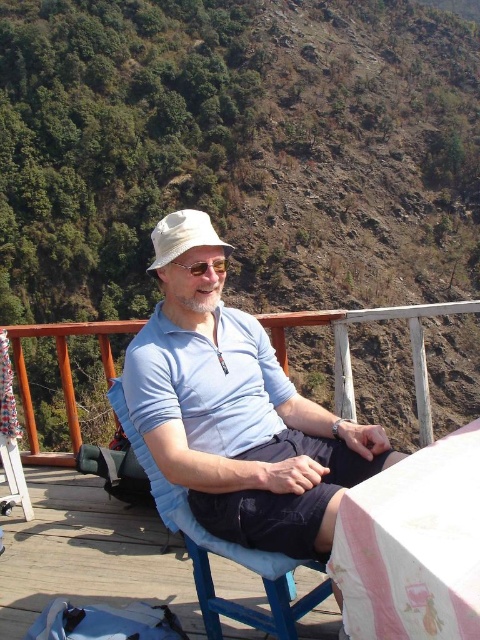
You are a photographer trying to capture the view of the green leafy hillside at upper left while also including the light blue cotton polo shirt at center in the frame. Based on their positions, will the hillside appear above the polo shirt in the photo?

Yes, the green leafy hillside at upper left is located above the light blue cotton polo shirt at center, so it will appear above the polo shirt in the photo.

You are a photographer setting up a tripod to capture the man in the light blue cotton shirt at center and the blue fabric chair at center. The tripod has a height adjustment that can only accommodate objects up to 1 meter in height. Can both objects be captured without needing to adjust the tripod height?

The light blue cotton shirt at center is taller than the blue fabric chair at center. Since the tripod can handle up to 1 meter, we need to check if the tallest object exceeds this. If the shirt is taller than the chair, but both are under 1m, then yes. However, if the shirt exceeds 1m, then no. But since the description only states their relative height, not absolute, we can assume the shirt is the tallest. If the shirt is under 1m, then yes. But without exact measurements, we can only say that as long as